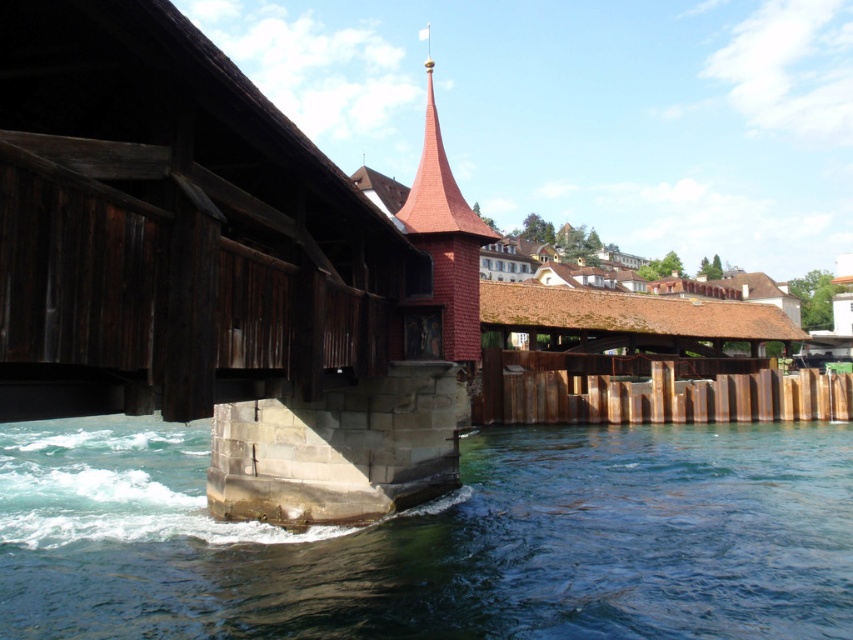
Question: From the image, what is the correct spatial relationship of clear blue water at lower left in relation to red wood spire at center?

Choices:
 (A) right
 (B) left

Answer: (B)

Question: Is clear blue water at lower left wider than red wood spire at center?

Choices:
 (A) no
 (B) yes

Answer: (B)

Question: Which of the following is the closest to the observer?

Choices:
 (A) (733, 522)
 (B) (445, 225)

Answer: (A)

Question: In this image, where is clear blue water at lower left located relative to red wood spire at center?

Choices:
 (A) right
 (B) left

Answer: (B)

Question: Which object is closer to the camera taking this photo?

Choices:
 (A) clear blue water at lower left
 (B) red wood spire at center

Answer: (A)